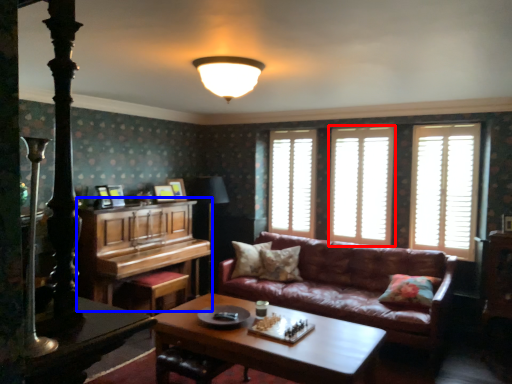
Question: Which point is closer to the camera, window (highlighted by a red box) or piano (highlighted by a blue box)?

Choices:
 (A) window
 (B) piano

Answer: (B)